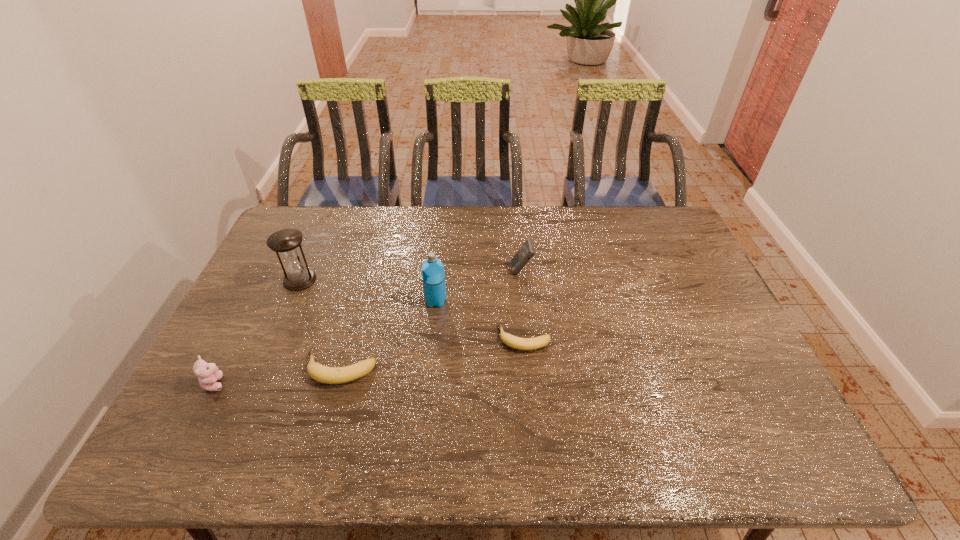
Find the location of a particular element. hourglass present at the left edge is located at coordinates (286, 243).

Locate an element on the screen. Image resolution: width=960 pixels, height=540 pixels. teddy bear at the left edge is located at coordinates (208, 373).

Image resolution: width=960 pixels, height=540 pixels. I want to click on object that is at the near left corner, so click(x=208, y=373).

This screenshot has width=960, height=540. Identify the location of vacant space at the far edge of the desktop. (404, 228).

This screenshot has height=540, width=960. I want to click on free spot at the near edge of the desktop, so click(549, 402).

Identify the location of free region at the left edge of the desktop. Image resolution: width=960 pixels, height=540 pixels. (240, 374).

In order to click on vacant space at the right edge in this screenshot , I will do `click(666, 248)`.

Image resolution: width=960 pixels, height=540 pixels. I want to click on vacant space at the far right corner of the desktop, so click(x=663, y=222).

The width and height of the screenshot is (960, 540). I want to click on free space that is in between the taller banana and the shorter banana, so click(432, 354).

Locate an element on the screen. free point between the fourth object from left to right and the third tallest object is located at coordinates (478, 286).